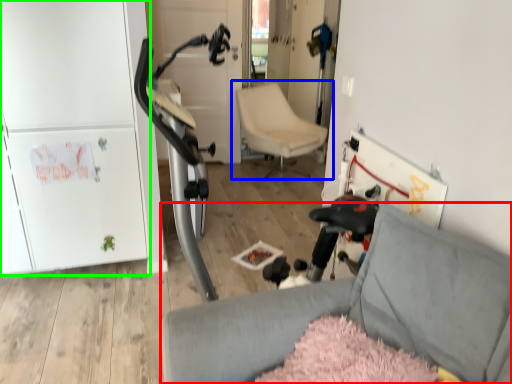
Question: Considering the real-world distances, which object is closest to chair (highlighted by a red box)? chair (highlighted by a blue box) or fridge (highlighted by a green box).

Choices:
 (A) chair
 (B) fridge

Answer: (B)